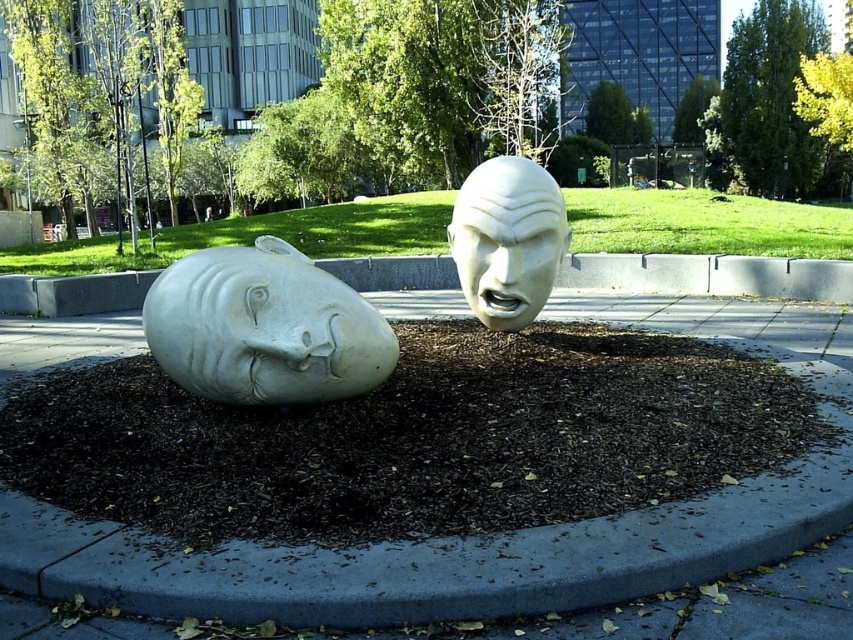
You are standing in front of two sculptures in the art installation. You want to take a photo of the white marble face at center without the white matte sculpture at center blocking the view. Is it possible to do so from your current position?

The white matte sculpture at center is closer to the viewer than the white marble face at center. Therefore, it is blocking the view of the white marble face at center from your current position, making it impossible to take a photo without the obstruction.

Consider the image. You are a visitor standing on the paved walkway around the mulch bed. You see the white marble head at left and the white marble face at center. Which sculpture is positioned lower in the scene?

The white marble head at left is positioned lower than the white marble face at center because it is described as being below it.

You are a maintenance worker needing to move both sculptures. Your cart can carry items up to 1.2 meters apart. Can you place both the white matte sculpture at center and the white marble face at center on the cart without exceeding the spacing limit?

The distance between the white matte sculpture at center and the white marble face at center is 1.12 meters, which is within the cart maximum of 1.2 meters. Yes, you can place both on the cart without exceeding the spacing limit.